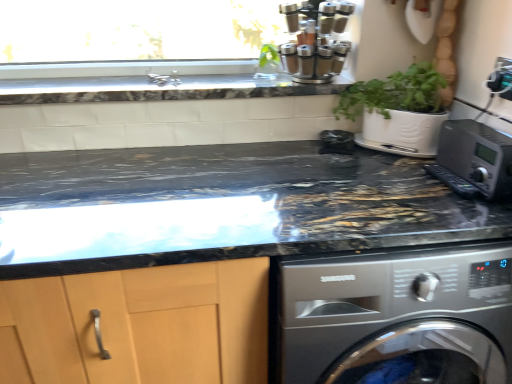
Find the location of a particular element. The image size is (512, 384). free space that is to the left of green leafy plant at upper center is located at coordinates (222, 79).